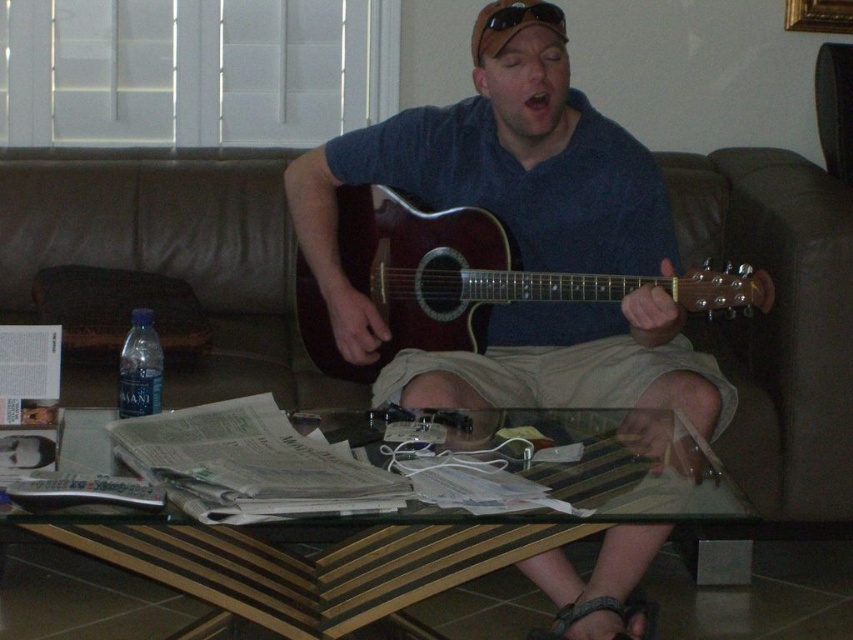
Is brown leather couch at center positioned before shiny brown acoustic guitar at center?

That is False.

Does brown leather couch at center have a lesser width compared to shiny brown acoustic guitar at center?

No, brown leather couch at center is not thinner than shiny brown acoustic guitar at center.

What do you see at coordinates (171, 253) in the screenshot? This screenshot has height=640, width=853. I see `brown leather couch at center` at bounding box center [171, 253].

Locate an element on the screen. The width and height of the screenshot is (853, 640). brown leather couch at center is located at coordinates (171, 253).

Does transparent glass table at center have a smaller size compared to blue plastic water bottle at left?

Result: No.

Is transparent glass table at center taller than blue plastic water bottle at left?

In fact, transparent glass table at center may be shorter than blue plastic water bottle at left.

Who is more forward, [585,413] or [215,262]?

Positioned in front is point [585,413].

The image size is (853, 640). I want to click on transparent glass table at center, so click(x=380, y=513).

Can you confirm if brown leather couch at center is bigger than blue plastic water bottle at left?

Correct, brown leather couch at center is larger in size than blue plastic water bottle at left.

Who is positioned more to the left, brown leather couch at center or blue plastic water bottle at left?

blue plastic water bottle at left

Where is `brown leather couch at center`? Image resolution: width=853 pixels, height=640 pixels. brown leather couch at center is located at coordinates (171, 253).